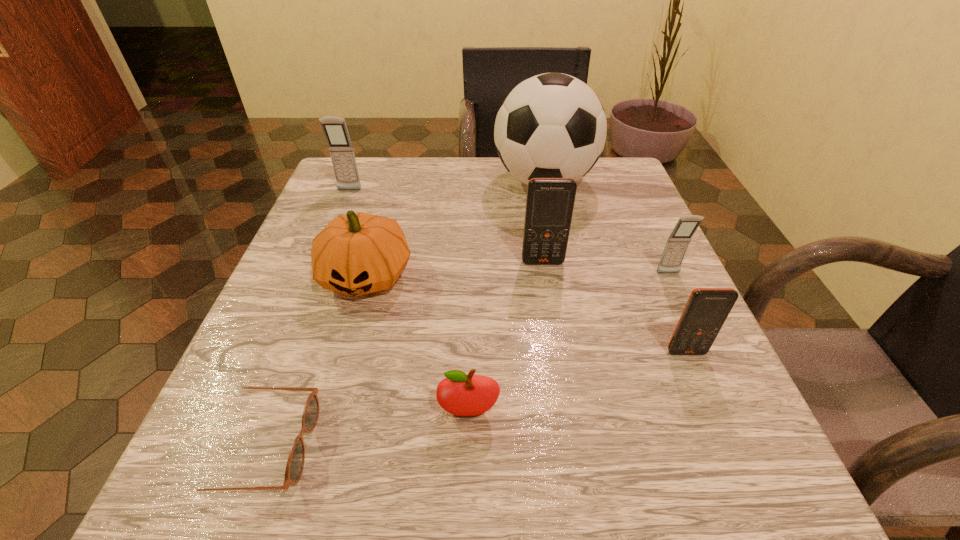
Find the location of a particular element. free space between the left gray cellular telephone and the left orange cellular telephone is located at coordinates (446, 226).

Where is `vacant space that's between the brown sunglasses and the gourd`? vacant space that's between the brown sunglasses and the gourd is located at coordinates 312,361.

I want to click on free space between the right gray cellular telephone and the brown sunglasses, so click(464, 360).

Locate an element on the screen. The width and height of the screenshot is (960, 540). free point between the left gray cellular telephone and the nearer orange cellular telephone is located at coordinates (517, 271).

You are a GUI agent. You are given a task and a screenshot of the screen. Output one action in this format:
    pyautogui.click(x=<x>, y=<y>)
    Task: Click on the free space between the second shortest object and the farther gray cellular telephone
    The width and height of the screenshot is (960, 540).
    Given the screenshot: What is the action you would take?
    pyautogui.click(x=409, y=301)

This screenshot has width=960, height=540. What are the coordinates of `free spot between the left orange cellular telephone and the smaller gray cellular telephone` in the screenshot? It's located at (606, 268).

You are a GUI agent. You are given a task and a screenshot of the screen. Output one action in this format:
    pyautogui.click(x=<x>, y=<y>)
    Task: Click on the free area in between the third farthest cellular telephone and the bigger orange cellular telephone
    
    Given the screenshot: What is the action you would take?
    pyautogui.click(x=606, y=268)

Find the location of `free point between the second cellular telephone from left to right and the brown sunglasses`. free point between the second cellular telephone from left to right and the brown sunglasses is located at coordinates (400, 354).

Locate an element on the screen. vacant area that lies between the fourth object from left to right and the bigger gray cellular telephone is located at coordinates (409, 301).

Identify which object is the sixth nearest to the apple. Please provide its 2D coordinates. Your answer should be formatted as a tuple, i.e. [(x, y)], where the tuple contains the x and y coordinates of a point satisfying the conditions above.

[(553, 125)]